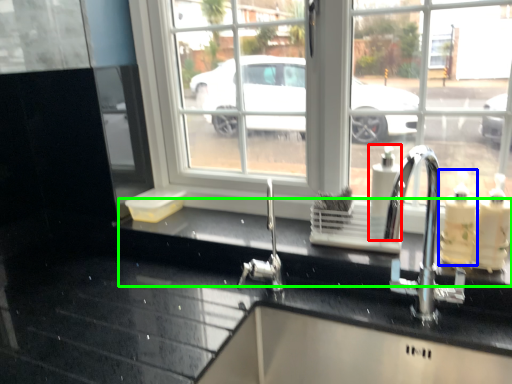
Question: Based on their relative distances, which object is nearer to soap dispenser (highlighted by a red box)? Choose from soap dispenser (highlighted by a blue box) and counter top (highlighted by a green box).

Choices:
 (A) soap dispenser
 (B) counter top

Answer: (A)